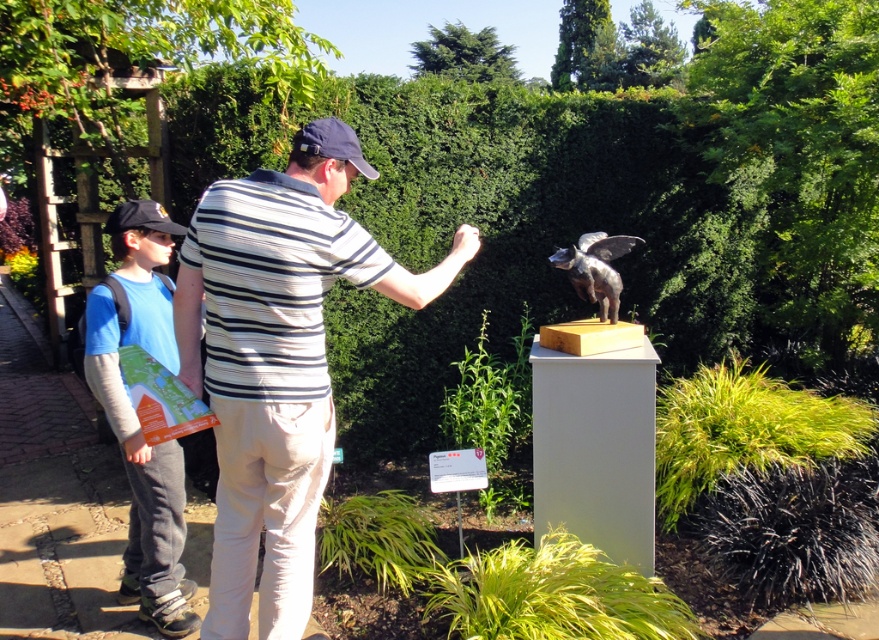
How far apart are striped cotton shirt at center and black fabric baseball cap at upper center?

striped cotton shirt at center and black fabric baseball cap at upper center are 64.16 centimeters apart from each other.

Who is taller, striped cotton shirt at center or black fabric baseball cap at upper center?

striped cotton shirt at center is taller.

Describe the element at coordinates (275, 369) in the screenshot. I see `striped cotton shirt at center` at that location.

At what (x,y) coordinates should I click in order to perform the action: click on striped cotton shirt at center. Please return your answer as a coordinate pair (x, y). Looking at the image, I should click on (275, 369).

Does polished bronze winged animal at center have a greater height compared to black fabric baseball cap at left?

Yes.

The height and width of the screenshot is (640, 879). I want to click on polished bronze winged animal at center, so [x=594, y=268].

You are a GUI agent. You are given a task and a screenshot of the screen. Output one action in this format:
    pyautogui.click(x=<x>, y=<y>)
    Task: Click on the polished bronze winged animal at center
    This screenshot has height=640, width=879.
    Given the screenshot: What is the action you would take?
    pyautogui.click(x=594, y=268)

Between striped cotton shirt at center and blue fabric map at left, which one appears on the left side from the viewer's perspective?

From the viewer's perspective, blue fabric map at left appears more on the left side.

Does striped cotton shirt at center have a smaller size compared to blue fabric map at left?

Yes, striped cotton shirt at center is smaller than blue fabric map at left.

Image resolution: width=879 pixels, height=640 pixels. Identify the location of striped cotton shirt at center. (275, 369).